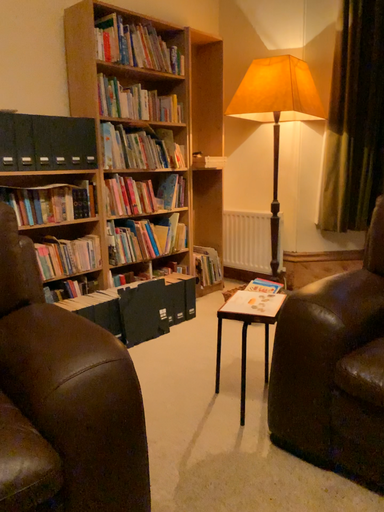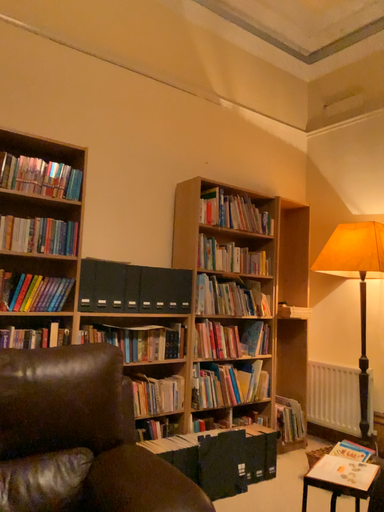
Question: Which way did the camera rotate in the video?

Choices:
 (A) rotated left
 (B) rotated right

Answer: (A)